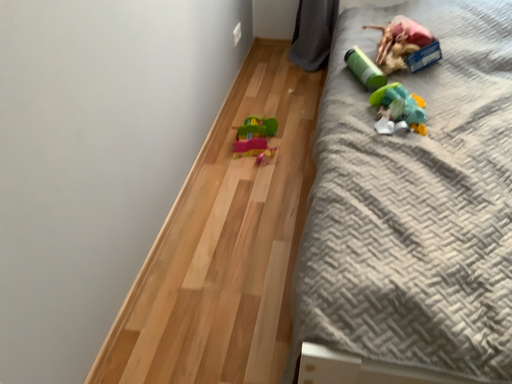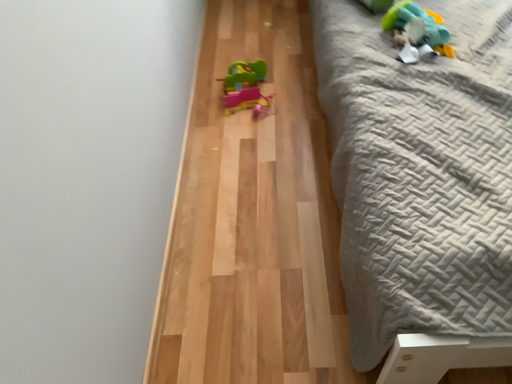
Question: How did the camera likely rotate when shooting the video?

Choices:
 (A) rotated downward
 (B) rotated upward

Answer: (A)